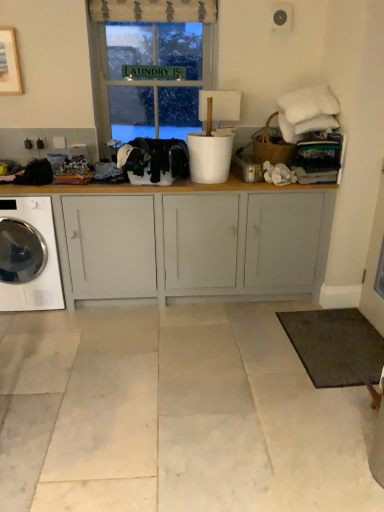
Question: Is matte gray cabinet at center bigger or smaller than metallic silver canister at center?

Choices:
 (A) big
 (B) small

Answer: (A)

Question: Visually, is matte gray cabinet at center positioned to the left or to the right of metallic silver canister at center?

Choices:
 (A) left
 (B) right

Answer: (A)

Question: Estimate the real-world distances between objects in this image. Which object is farther from the metallic silver canister at center?

Choices:
 (A) matte gray cabinet at center
 (B) dark gray carpet at lower right
 (C) green glass window at upper center
 (D) white glossy washing machine at lower left
 (E) black fabric at center, the first clothing in the right-to-left sequence

Answer: (D)

Question: Estimate the real-world distances between objects in this image. Which object is closer to the metallic silver canister at center?

Choices:
 (A) black fabric at center, the first clothing in the right-to-left sequence
 (B) white glossy washing machine at lower left
 (C) green glass window at upper center
 (D) dark gray carpet at lower right
 (E) matte gray cabinet at center

Answer: (A)